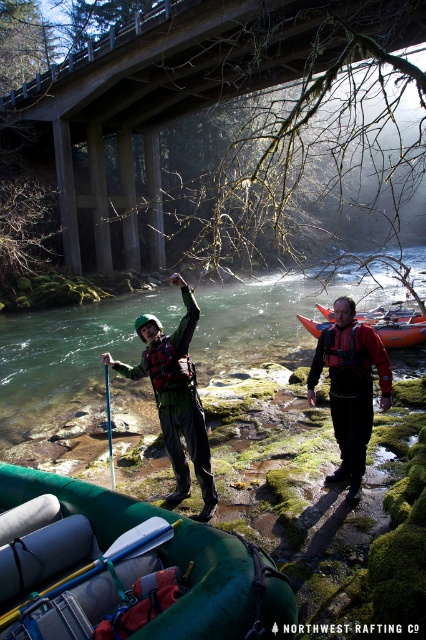
You are a photographer positioned at the riverbank. You need to capture a photo of the green rubber raft at lower left and the smooth black paddle at center. According to the scene description, which object is positioned to the right of the other?

The green rubber raft at lower left is to the right of the smooth black paddle at center.

You are standing at the riverbank and want to reach both points marked in the image. Which point, point [192,618] or point [109,472], should you approach first if you want to start from the closest one?

You should approach point [192,618] first because it is closer to you than point [109,472].

You are a safety inspector assessing the rafting gear setup in the image. You notice the matte green jacket at center and the brushed metal life jacket at center. According to safety protocols, which item should be positioned higher to ensure visibility during rescue operations?

The brushed metal life jacket at center should be positioned higher than the matte green jacket at center to ensure visibility during rescue operations.